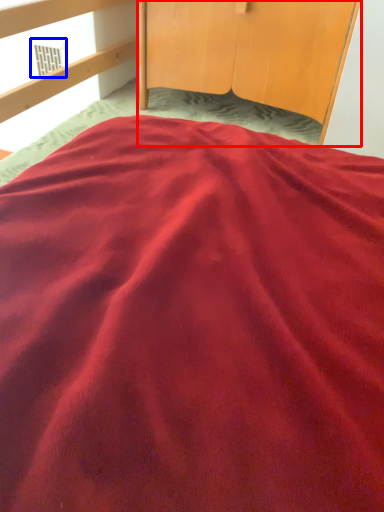
Question: Which object is closer to the camera taking this photo, furniture (highlighted by a red box) or window (highlighted by a blue box)?

Choices:
 (A) furniture
 (B) window

Answer: (A)